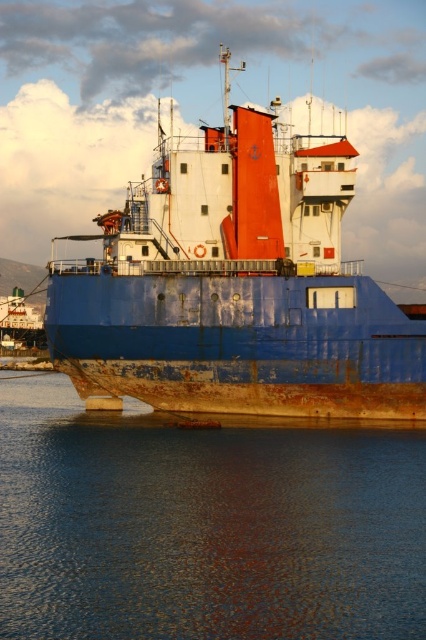
Is rusty metallic water at lower center thinner than rusty metal ship at center?

Yes, rusty metallic water at lower center is thinner than rusty metal ship at center.

Between point (270, 525) and point (140, 312), which one is positioned in front?

Point (270, 525) is in front.

I want to click on rusty metallic water at lower center, so click(204, 525).